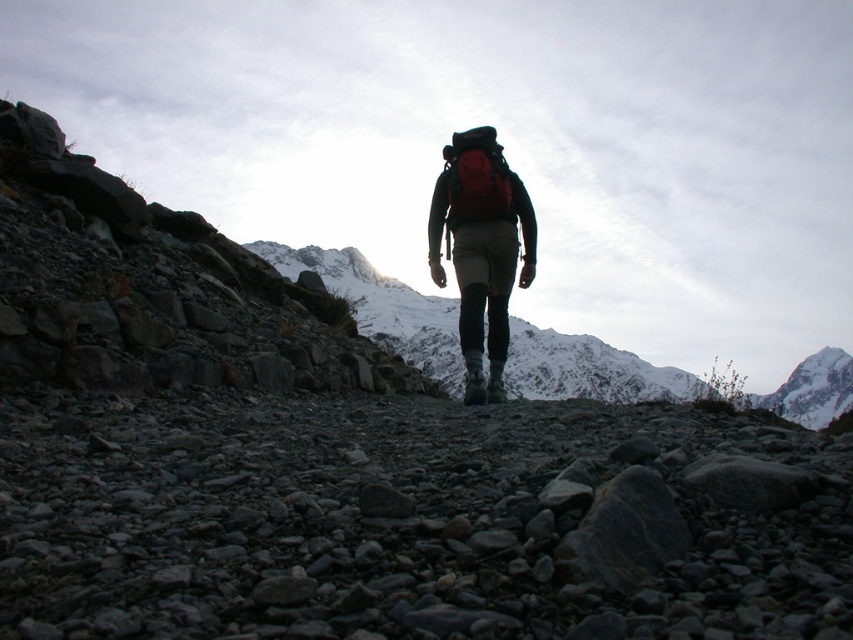
Does matte red backpack at center appear on the right side of red fabric backpack at center?

Yes, matte red backpack at center is to the right of red fabric backpack at center.

Consider the image. Between matte red backpack at center and red fabric backpack at center, which one appears on the left side from the viewer's perspective?

From the viewer's perspective, red fabric backpack at center appears more on the left side.

Find the location of a particular element. matte red backpack at center is located at coordinates (480, 248).

Does point (473, 250) lie in front of point (839, 406)?

Yes, point (473, 250) is in front of point (839, 406).

Between matte red backpack at center and snowy white peak at upper right, which one appears on the left side from the viewer's perspective?

matte red backpack at center is more to the left.

At what (x,y) coordinates should I click in order to perform the action: click on matte red backpack at center. Please return your answer as a coordinate pair (x, y). The width and height of the screenshot is (853, 640). Looking at the image, I should click on (480, 248).

The width and height of the screenshot is (853, 640). I want to click on matte red backpack at center, so click(480, 248).

Who is higher up, red fabric backpack at center or snowy white peak at upper right?

red fabric backpack at center

Which is behind, point (476, 138) or point (851, 365)?

Positioned behind is point (851, 365).

Where is `red fabric backpack at center`? This screenshot has height=640, width=853. red fabric backpack at center is located at coordinates (476, 179).